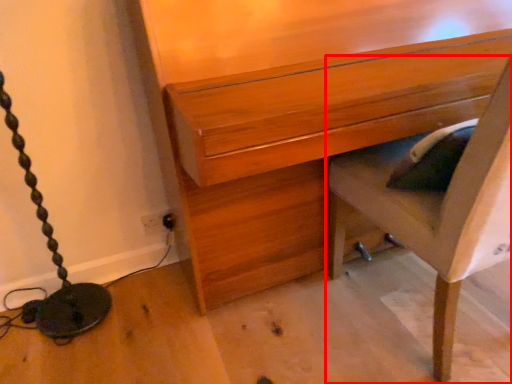
Question: From the image's perspective, where is furniture (annotated by the red box) located in relation to chest of drawers in the image?

Choices:
 (A) above
 (B) below

Answer: (B)